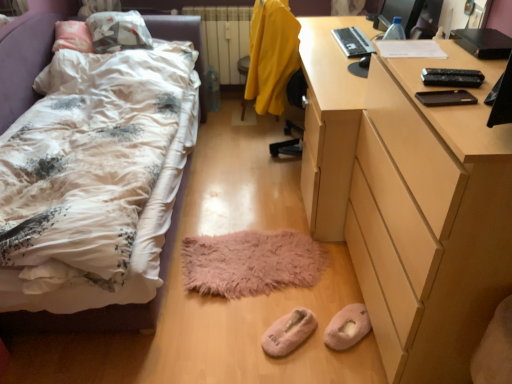
Question: Does point (264, 347) appear closer or farther from the camera than point (356, 304)?

Choices:
 (A) farther
 (B) closer

Answer: (B)

Question: In the image, is pink fluffy slippers at lower center, the 1th footwear from the left, positioned in front of or behind pink fluffy slippers at lower center, which is the second footwear in left-to-right order?

Choices:
 (A) front
 (B) behind

Answer: (A)

Question: Considering the real-world distances, which object is farthest from the pink fluffy slippers at lower center, acting as the 1th footwear starting from the right?

Choices:
 (A) white painted metal radiator at center
 (B) yellow fabric swivel chair at center
 (C) light brown wooden desk at right
 (D) pink fluffy slippers at lower center, arranged as the 2th footwear when viewed from the right
 (E) fluffy white bed at left

Answer: (A)

Question: Which object is positioned closest to the fuzzy pink mat at center?

Choices:
 (A) pink fluffy slippers at lower center, which is the second footwear in left-to-right order
 (B) yellow fabric swivel chair at center
 (C) light brown wooden desk at right
 (D) black plastic laptop at upper right
 (E) pink fluffy slippers at lower center, arranged as the 2th footwear when viewed from the right

Answer: (E)